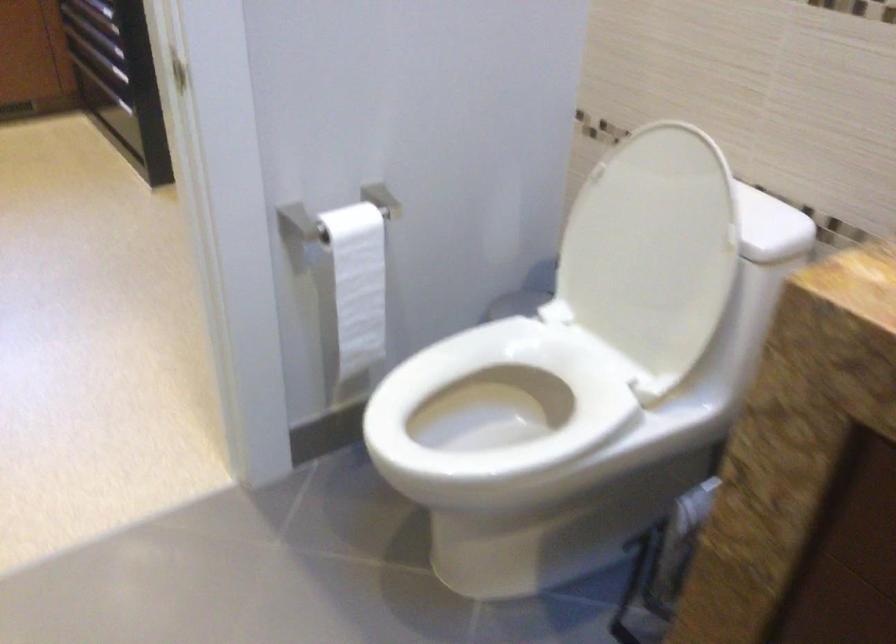
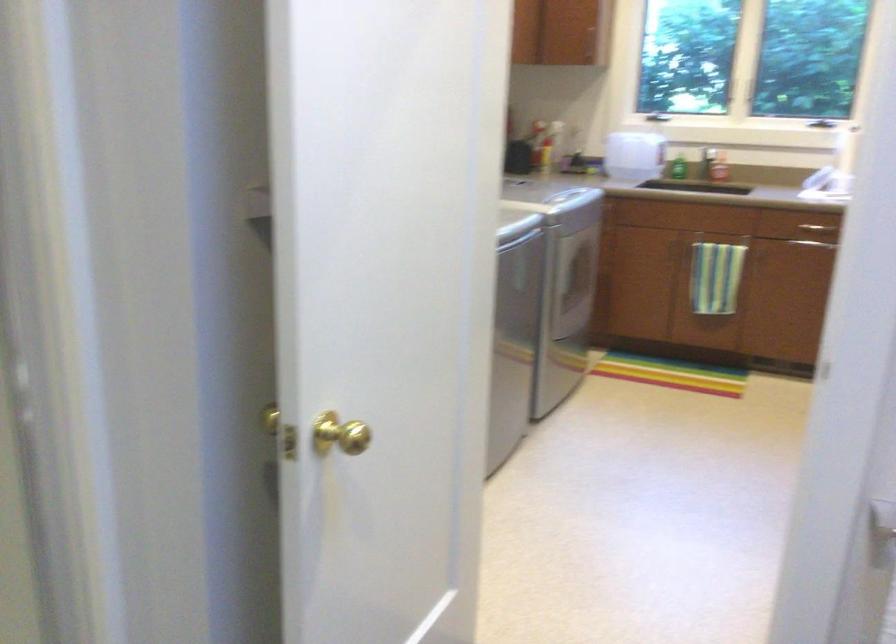
Question: The camera is either moving clockwise (left) or counter-clockwise (right) around the object. The first image is from the beginning of the video and the second image is from the end. Is the camera moving left or right when shooting the video?

Choices:
 (A) Left
 (B) Right

Answer: (B)